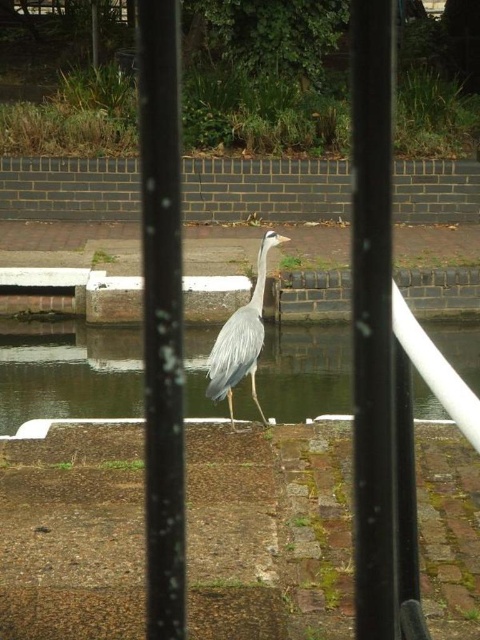
You are a photographer trying to capture the gray feathered heron at center. You notice the clear water at center in the foreground. Will the heron be partially obscured by the water when you take the photo from your current position?

The gray feathered heron at center is behind clear water at center, so the heron will be partially obscured by the water when taking the photo from your current position.

You are a photographer trying to capture the grey heron in the scene. You notice two points marked on your camera screen at coordinates point (24, 412) and point (232, 316). Which point is closer to the camera?

Point (24, 412) is further to the camera than point (232, 316), so the point closer to the camera is point (232, 316).